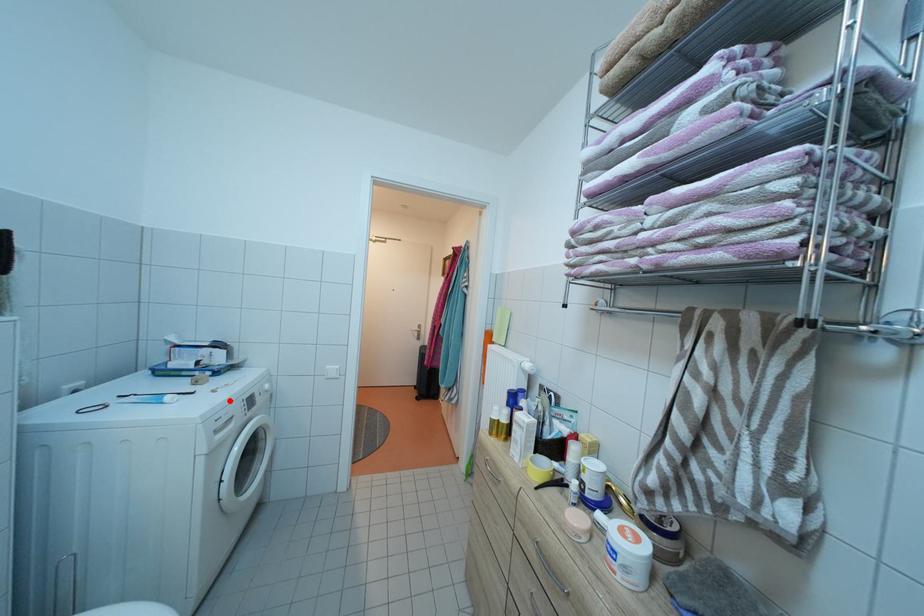
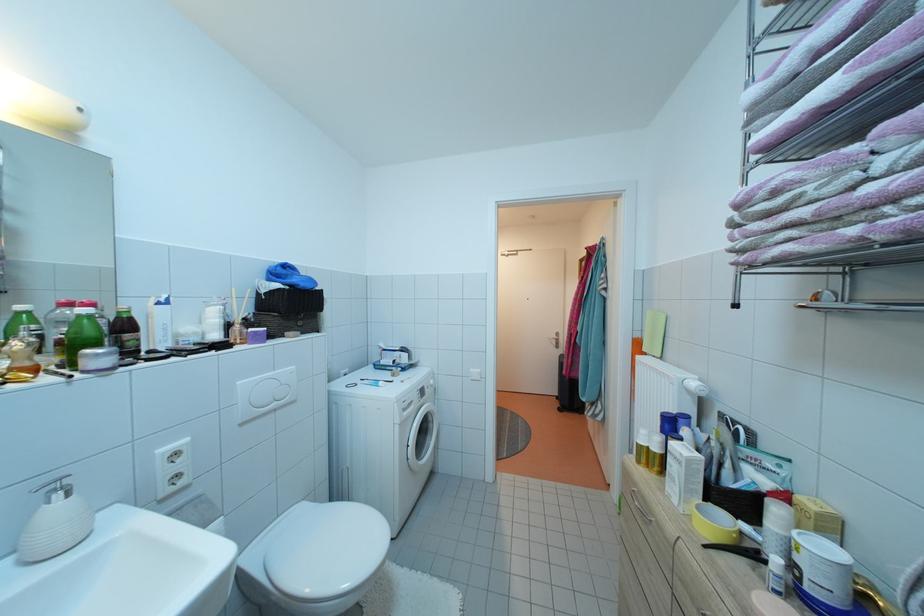
Question: A red point is marked in image1. In image2, is the corresponding 3D point closer to the camera or farther? Reply with the corresponding letter.

Choices:
 (A) The corresponding 3D point is closer.
 (B) The corresponding 3D point is farther.

Answer: (B)